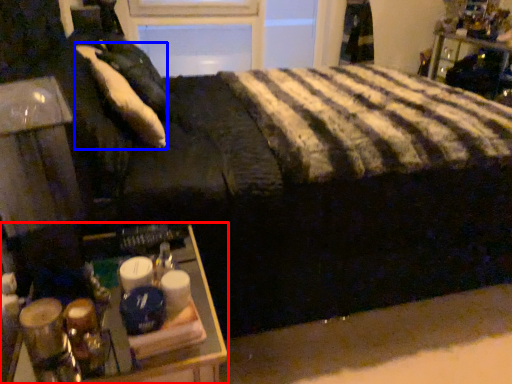
Question: Which object appears closest to the camera in this image, table (highlighted by a red box) or pillow (highlighted by a blue box)?

Choices:
 (A) table
 (B) pillow

Answer: (A)